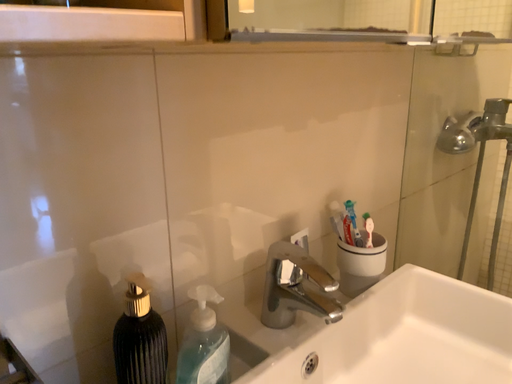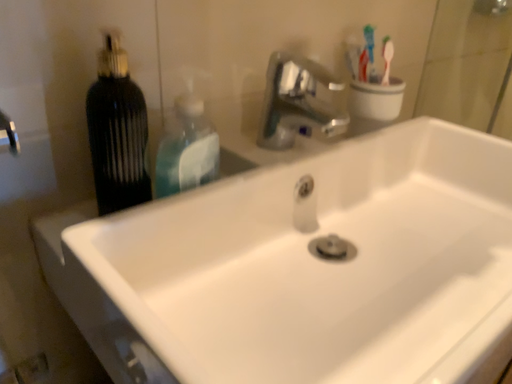
Question: How did the camera likely rotate when shooting the video?

Choices:
 (A) rotated downward
 (B) rotated upward

Answer: (A)